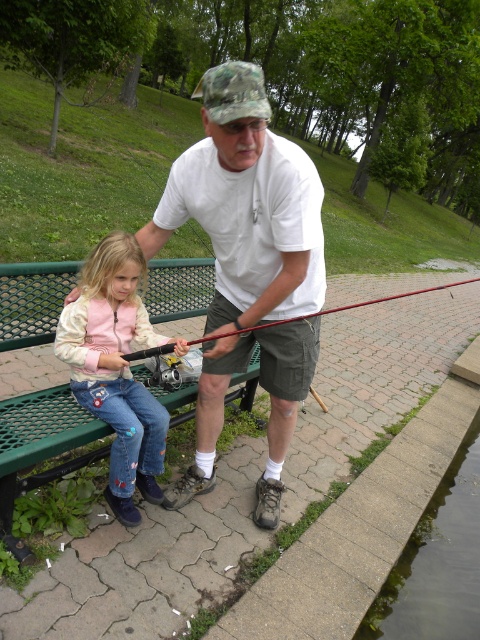
Does denim jeans at left have a lesser height compared to red fiberglass rod at center?

Correct, denim jeans at left is not as tall as red fiberglass rod at center.

What do you see at coordinates (117, 369) in the screenshot?
I see `denim jeans at left` at bounding box center [117, 369].

You are a GUI agent. You are given a task and a screenshot of the screen. Output one action in this format:
    pyautogui.click(x=<x>, y=<y>)
    Task: Click on the denim jeans at left
    This screenshot has height=640, width=480.
    Given the screenshot: What is the action you would take?
    pyautogui.click(x=117, y=369)

Is green metal bench at lower left to the left of red fiberglass rod at center from the viewer's perspective?

Correct, you'll find green metal bench at lower left to the left of red fiberglass rod at center.

Is point (146, 300) more distant than point (295, 317)?

Yes, it is behind point (295, 317).

This screenshot has height=640, width=480. Find the location of `green metal bench at lower left`. green metal bench at lower left is located at coordinates (39, 445).

Does white matte shirt at center appear under green metal bench at lower left?

Incorrect, white matte shirt at center is not positioned below green metal bench at lower left.

Can you confirm if white matte shirt at center is thinner than green metal bench at lower left?

Indeed, white matte shirt at center has a lesser width compared to green metal bench at lower left.

Is point (312, 280) farther from camera compared to point (105, 448)?

No, it is in front of (105, 448).

This screenshot has height=640, width=480. In order to click on white matte shirt at center in this screenshot , I will do `click(247, 205)`.